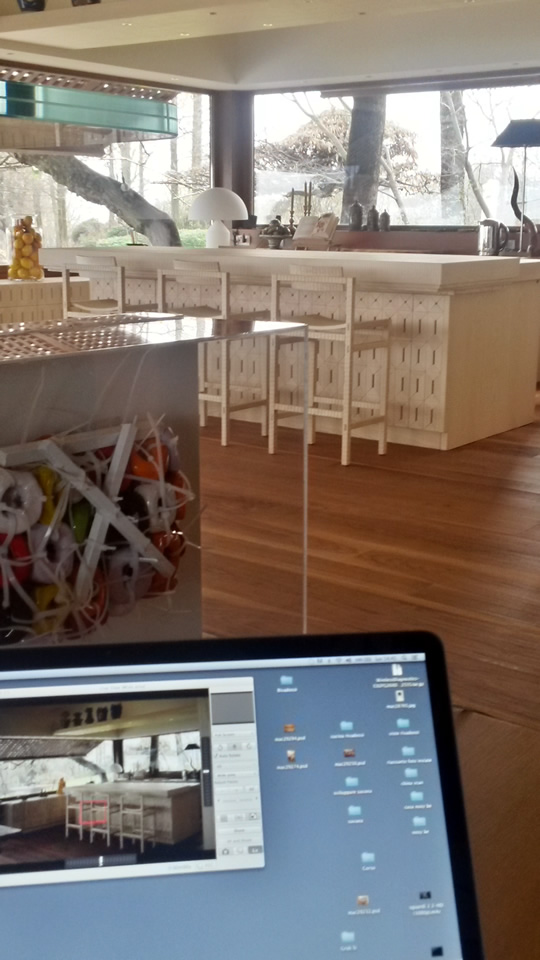
The height and width of the screenshot is (960, 540). In order to click on wooden floor in this screenshot , I will do `click(468, 535)`.